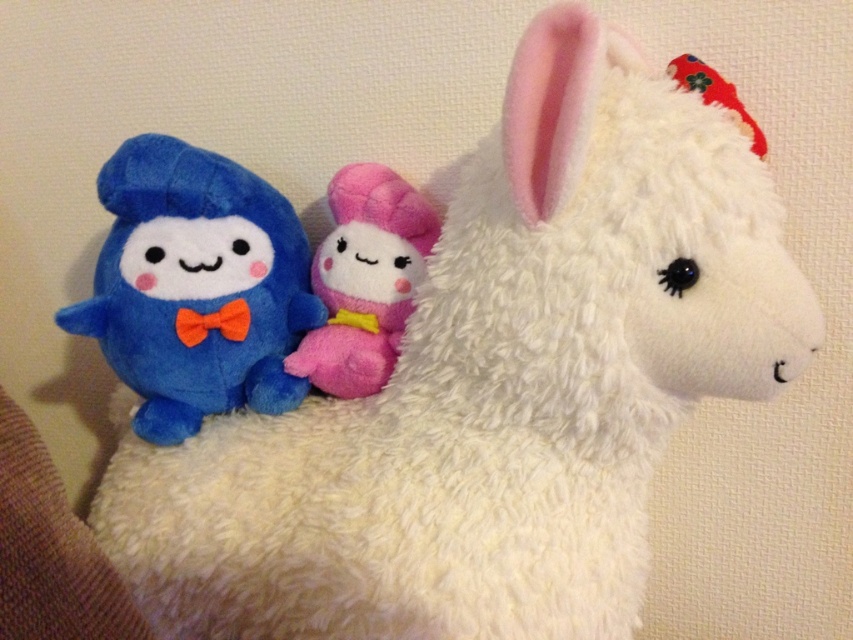
Question: Is blue plush toy at left positioned behind pink plush toy at center?

Choices:
 (A) no
 (B) yes

Answer: (A)

Question: Which of the following is the closest to the observer?

Choices:
 (A) blue plush toy at left
 (B) pink plush toy at center

Answer: (A)

Question: Can you confirm if blue plush toy at left is bigger than pink plush toy at center?

Choices:
 (A) yes
 (B) no

Answer: (A)

Question: Which point is farther to the camera?

Choices:
 (A) (332, 280)
 (B) (184, 307)

Answer: (A)

Question: In this image, where is blue plush toy at left located relative to pink plush toy at center?

Choices:
 (A) left
 (B) right

Answer: (A)

Question: Among these objects, which one is nearest to the camera?

Choices:
 (A) pink plush toy at center
 (B) blue plush toy at left

Answer: (B)